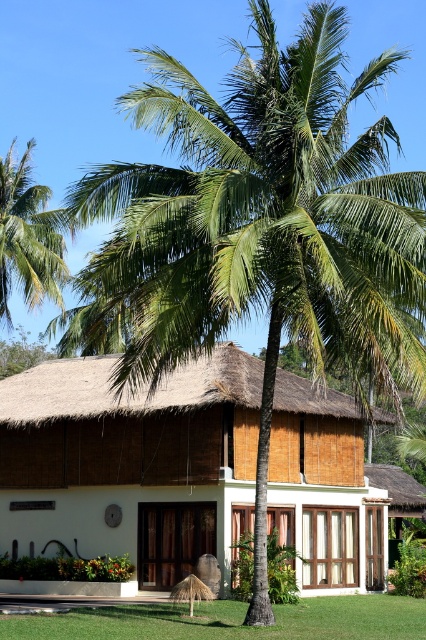
You are planning to take a photo of the white wood cottage at center and the green leafy palm tree at upper left. Which object should you focus on first if you want to capture both in a single frame without moving the camera? Explain your reasoning based on their sizes in the image.

The white wood cottage at center should be focused on first because its width surpasses the green leafy palm tree at upper left, making it larger and more prominent in the frame.

You are standing in front of the tropical villa and want to take a photo that includes both the point at coordinates point (x=403, y=598) and point (x=20, y=280). Based on their positions, which point will appear larger in the photo?

Point (x=403, y=598) is closer to the camera than point (x=20, y=280), so it will appear larger in the photo.